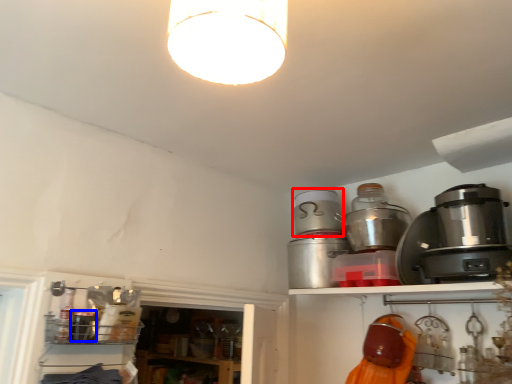
Question: Among these objects, which one is nearest to the camera, appliance (highlighted by a red box) or appliance (highlighted by a blue box)?

Choices:
 (A) appliance
 (B) appliance

Answer: (B)